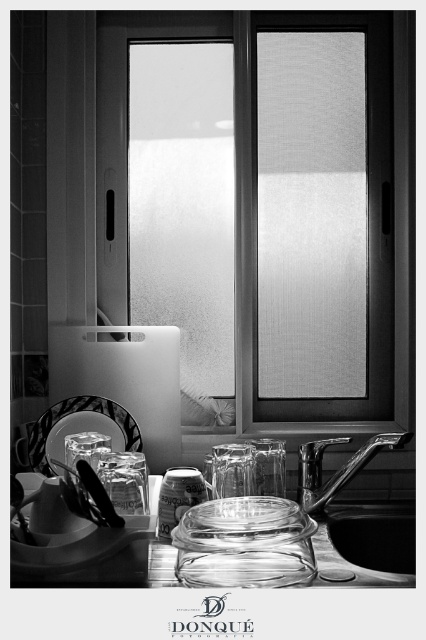
Which of these two, transparent glass jar at center or clear glass platter at lower center, stands shorter?

transparent glass jar at center

Is transparent glass jar at center shorter than clear glass platter at lower center?

Yes.

Does point (36, 548) come farther from viewer compared to point (126, 410)?

No.

You are a GUI agent. You are given a task and a screenshot of the screen. Output one action in this format:
    pyautogui.click(x=<x>, y=<y>)
    Task: Click on the transparent glass jar at center
    The height and width of the screenshot is (640, 426).
    Given the screenshot: What is the action you would take?
    pyautogui.click(x=83, y=560)

Describe the element at coordinates (252, 193) in the screenshot. I see `frosted glass window at center` at that location.

Is point (115, 195) positioned behind point (46, 412)?

Yes, it is behind point (46, 412).

Between point (383, 195) and point (43, 448), which one is positioned behind?

Positioned behind is point (383, 195).

Identify the location of frosted glass window at center. Image resolution: width=426 pixels, height=640 pixels. (252, 193).

Which is more to the left, metallic sink at lower right or clear glass platter at lower center?

clear glass platter at lower center

Locate an element on the screen. metallic sink at lower right is located at coordinates (368, 516).

What do you see at coordinates (368, 516) in the screenshot? I see `metallic sink at lower right` at bounding box center [368, 516].

This screenshot has height=640, width=426. Identify the location of metallic sink at lower right. (368, 516).